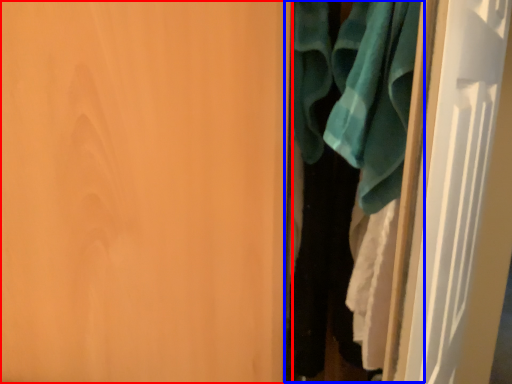
Question: Which object is further to the camera taking this photo, door (highlighted by a red box) or closet (highlighted by a blue box)?

Choices:
 (A) door
 (B) closet

Answer: (B)